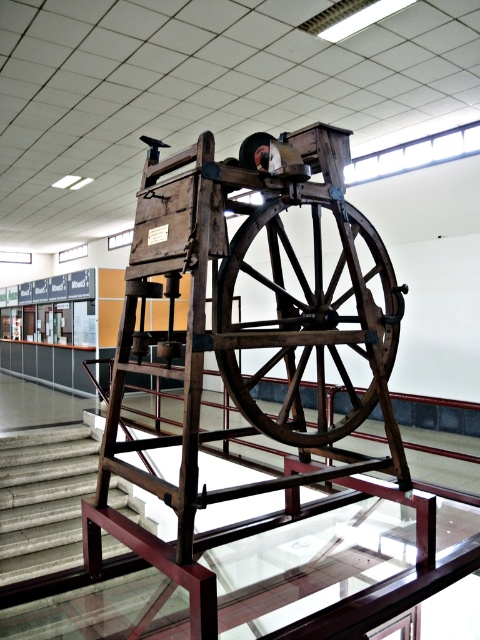
You are standing in front of the vintage wooden spinning wheel exhibit. You want to take a photo of the dark brown wooden wheel at center with your phone, which has a maximum focus range of 6 feet. Can you capture a clear photo without moving closer?

The dark brown wooden wheel at center and camera are 5.98 feet apart from each other. Since the distance is within the 6 feet focus range, you can capture a clear photo without moving closer.